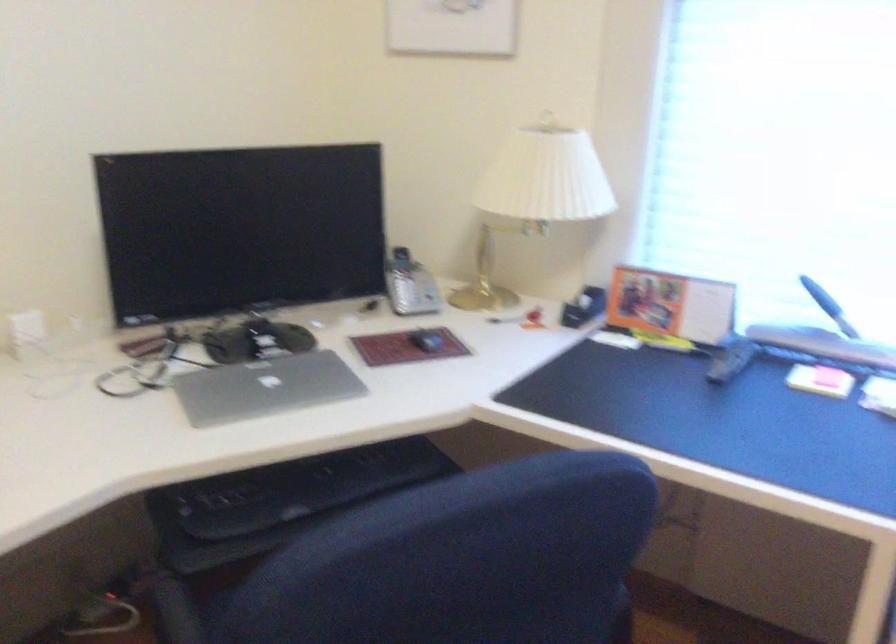
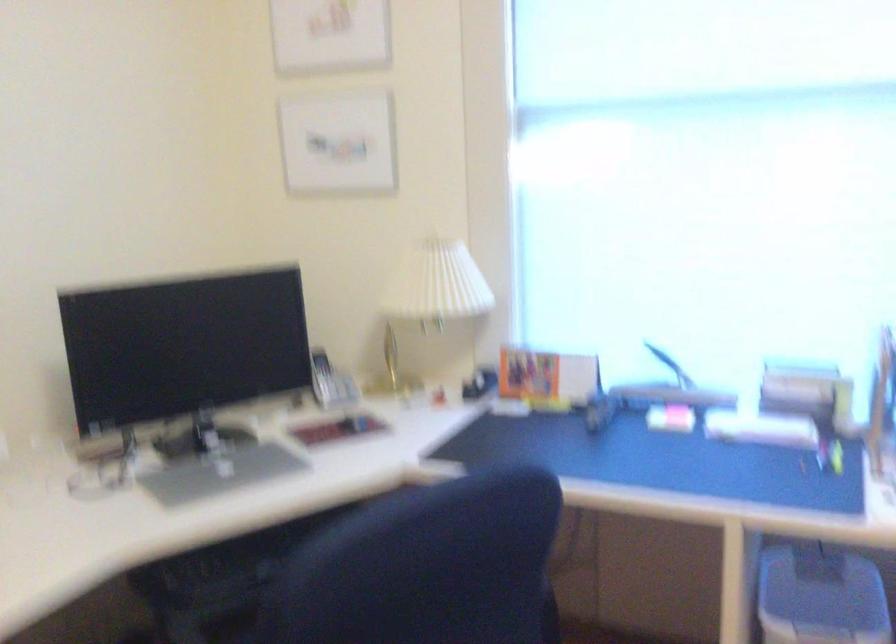
Question: Based on the continuous images, in which direction is the camera rotating? Reply with the corresponding letter.

Choices:
 (A) Left
 (B) Right
 (C) Up
 (D) Down

Answer: (B)